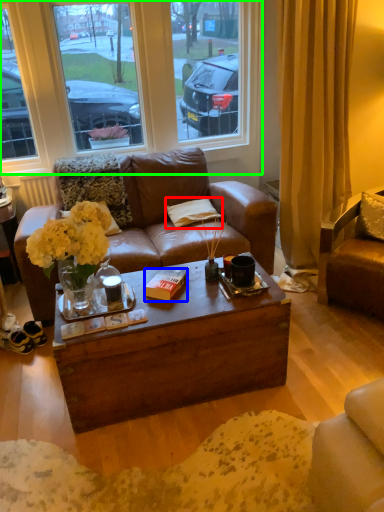
Question: Estimate the real-world distances between objects in this image. Which object is closer to pillow (highlighted by a red box), book (highlighted by a blue box) or window (highlighted by a green box)?

Choices:
 (A) book
 (B) window

Answer: (A)